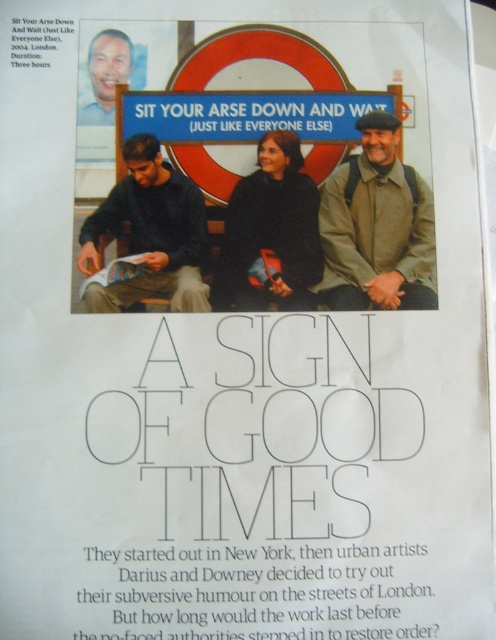
Is black matte jacket at center bigger than matte black face at upper left?

Yes.

Locate an element on the screen. black matte jacket at center is located at coordinates (270, 232).

Is point (145, 292) farther from viewer compared to point (124, 51)?

No, it is in front of (124, 51).

Is point (127, 196) closer to viewer compared to point (96, 42)?

Yes, it is in front of point (96, 42).

What are the coordinates of `dark blue sweater at left` in the screenshot? It's located at (149, 234).

Does khaki fabric jacket at center have a lesser height compared to black matte jacket at center?

No.

Who is shorter, khaki fabric jacket at center or black matte jacket at center?

With less height is black matte jacket at center.

Does point (398, 234) come behind point (311, 241)?

Yes, it is.

Where is `khaki fabric jacket at center`? This screenshot has height=640, width=496. khaki fabric jacket at center is located at coordinates (376, 227).